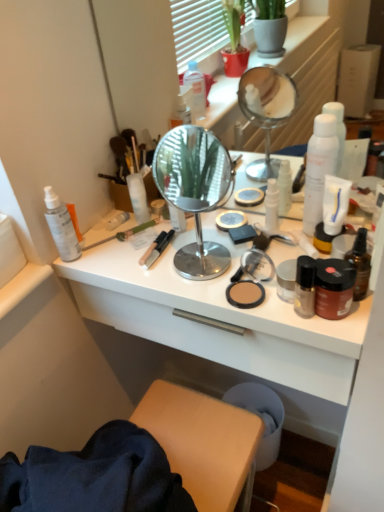
Image resolution: width=384 pixels, height=512 pixels. I want to click on vacant space that's between white matte spray can at left, marked as the second toiletry in a left-to-right arrangement, and white glossy bottle at center, the 5th toiletry viewed from the left, so click(x=169, y=241).